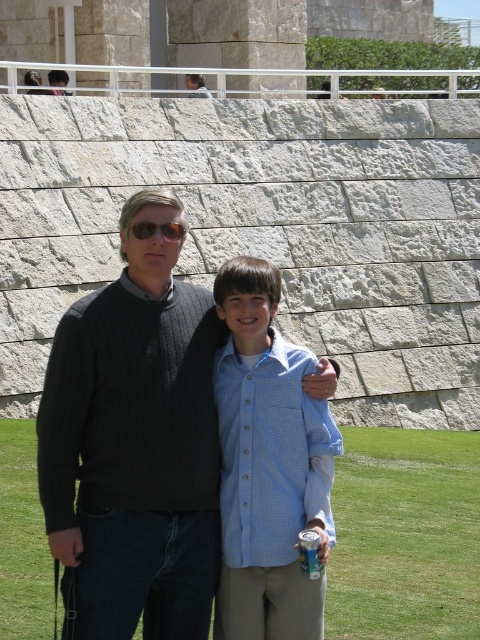
Question: Which of the following is the farthest from the observer?

Choices:
 (A) matte black sunglasses at upper center
 (B) clear plastic can at lower center

Answer: (A)

Question: Estimate the real-world distances between objects in this image. Which object is farther from the dark gray sweater at center?

Choices:
 (A) light blue button-down shirt at center
 (B) matte black sunglasses at upper center

Answer: (B)

Question: Is dark gray sweater at center bigger than matte black sunglasses at upper center?

Choices:
 (A) no
 (B) yes

Answer: (A)

Question: Considering the relative positions of clear plastic can at lower center and matte black sunglasses at upper center in the image provided, where is clear plastic can at lower center located with respect to matte black sunglasses at upper center?

Choices:
 (A) above
 (B) below

Answer: (B)

Question: Estimate the real-world distances between objects in this image. Which object is closer to the light blue button-down shirt at center?

Choices:
 (A) matte black sunglasses at upper center
 (B) clear plastic can at lower center

Answer: (A)

Question: Is dark gray sweater at center further to camera compared to matte black sunglasses at upper center?

Choices:
 (A) no
 (B) yes

Answer: (B)